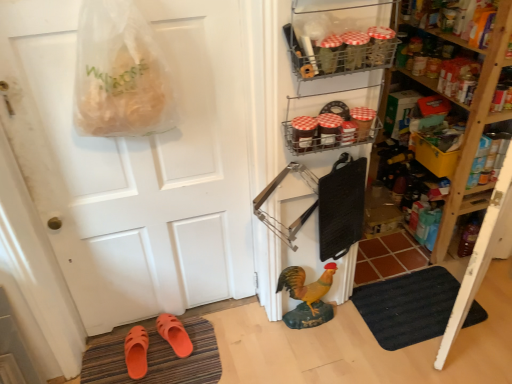
Locate an element on the screen. The image size is (512, 384). vacant space to the right of orange rubber doormat at lower left, arranged as the first doormat when viewed from the left is located at coordinates (250, 344).